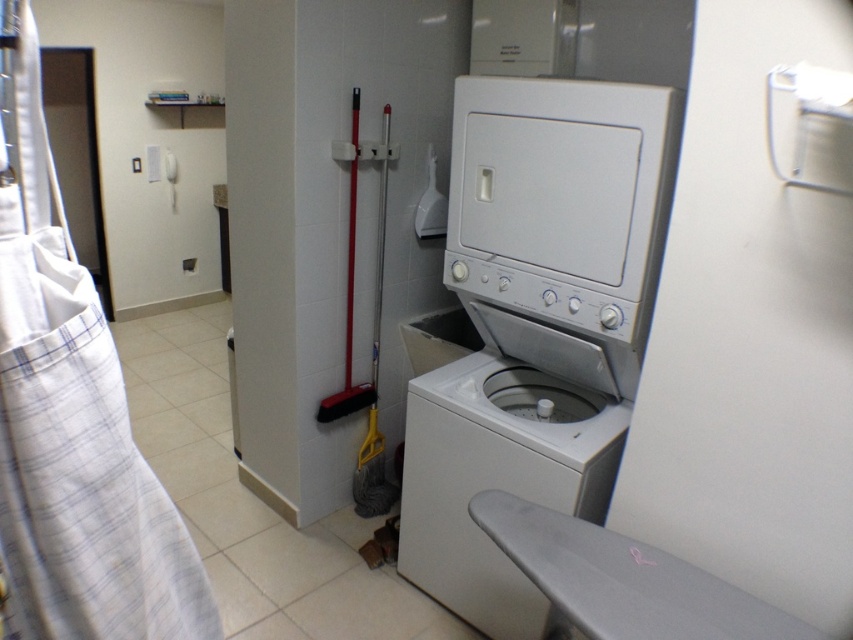
Question: Based on their relative distances, which object is nearer to the white plastic washing machine at center?

Choices:
 (A) white plastic washing machine at lower center
 (B) white plaid fabric at left

Answer: (A)

Question: Which object appears farthest from the camera in this image?

Choices:
 (A) white plaid fabric at left
 (B) white plastic washing machine at lower center

Answer: (B)

Question: In this image, where is white plaid fabric at left located relative to white plastic washing machine at lower center?

Choices:
 (A) left
 (B) right

Answer: (A)

Question: Which point is closer to the camera taking this photo?

Choices:
 (A) (32, 593)
 (B) (634, 253)

Answer: (A)

Question: Does white plaid fabric at left lie in front of white plastic washing machine at lower center?

Choices:
 (A) yes
 (B) no

Answer: (A)

Question: Does white plastic washing machine at center appear on the right side of white plaid fabric at left?

Choices:
 (A) no
 (B) yes

Answer: (B)